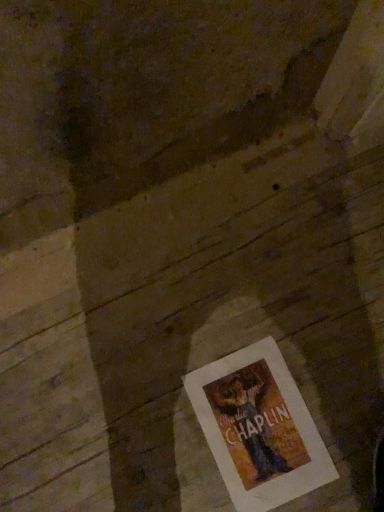
The image size is (384, 512). I want to click on vacant space behind matte paper poster at lower center, so click(x=234, y=311).